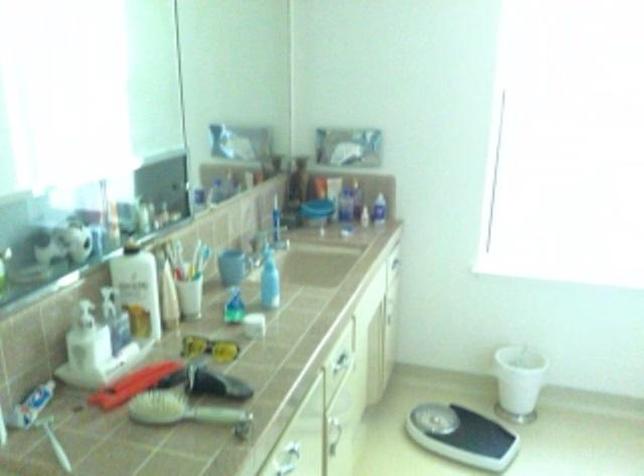
Find where to press the blue dispenser pump. Please return your answer as a coordinate pair (x, y).

(269, 281)